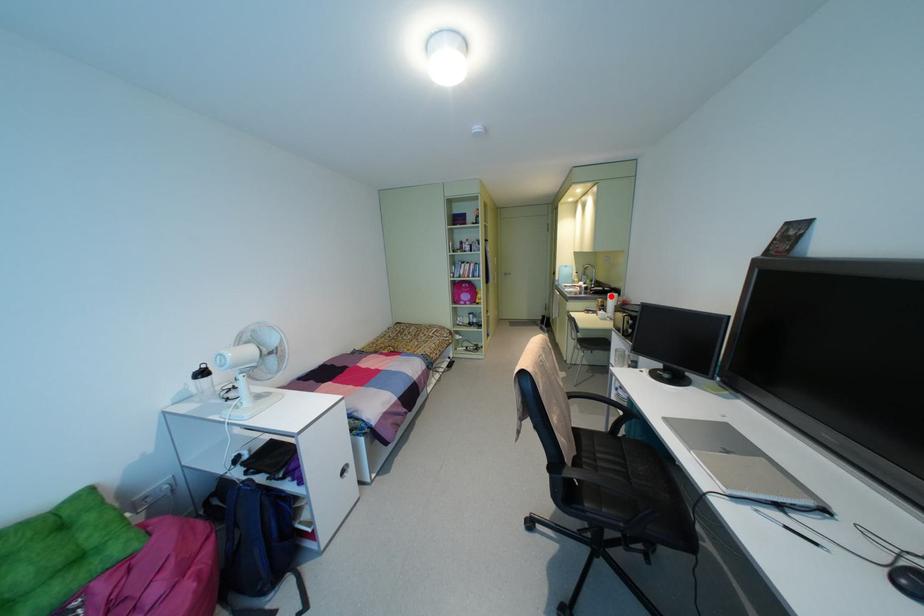
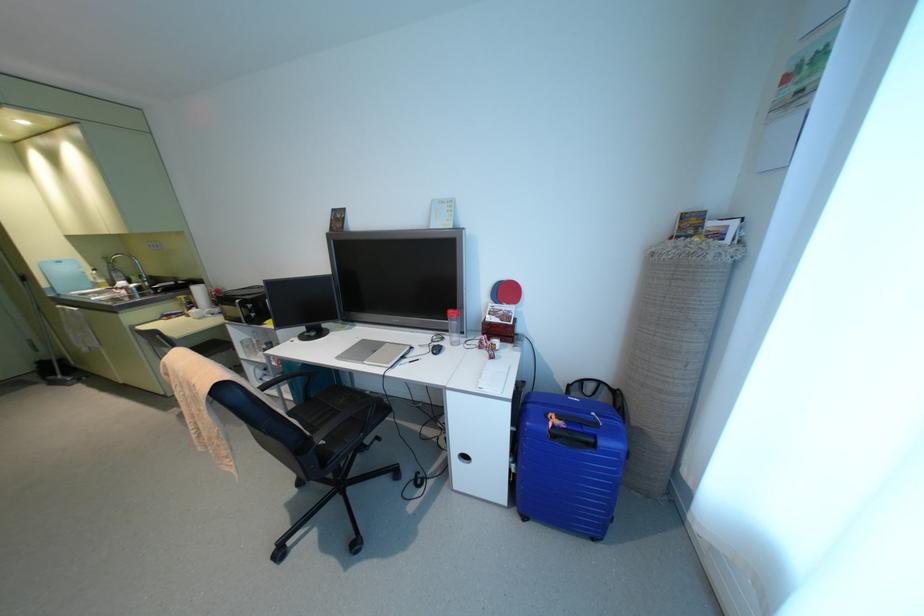
In the second image, find the point that corresponds to the highlighted location in the first image.

(196, 289)